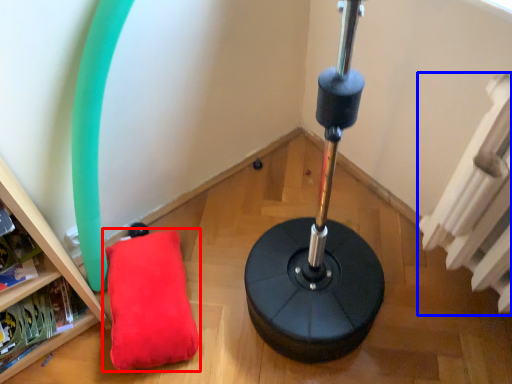
Question: Which object is closer to the camera taking this photo, pillow (highlighted by a red box) or radiator (highlighted by a blue box)?

Choices:
 (A) pillow
 (B) radiator

Answer: (B)